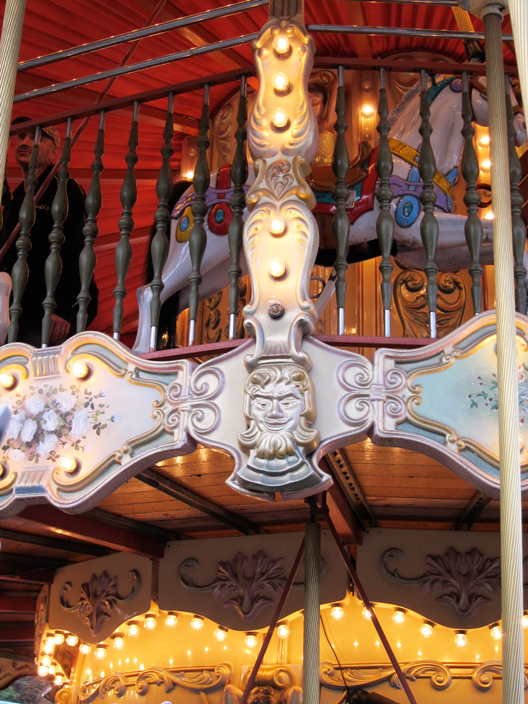
The height and width of the screenshot is (704, 528). Identify the location of top floor ceiling. (372, 18).